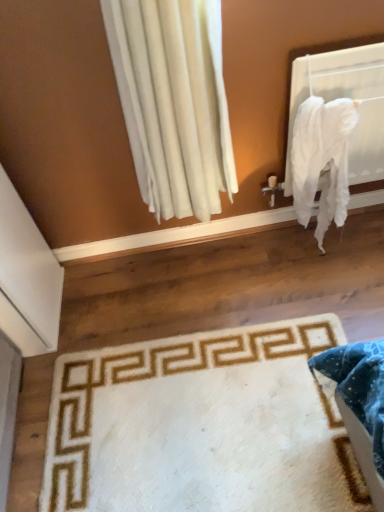
Question: Does white fabric at upper right lie behind white plush rug at lower center?

Choices:
 (A) yes
 (B) no

Answer: (A)

Question: Is white fabric at upper right positioned with its back to white plush rug at lower center?

Choices:
 (A) yes
 (B) no

Answer: (B)

Question: From the image's perspective, is white fabric at upper right located above white plush rug at lower center?

Choices:
 (A) yes
 (B) no

Answer: (A)

Question: Can you confirm if white fabric at upper right is taller than white plush rug at lower center?

Choices:
 (A) yes
 (B) no

Answer: (A)

Question: Is white plush rug at lower center surrounded by white fabric at upper right?

Choices:
 (A) yes
 (B) no

Answer: (B)

Question: Considering the positions of white plush rug at lower center and white cotton blanket at right in the image, is white plush rug at lower center bigger or smaller than white cotton blanket at right?

Choices:
 (A) small
 (B) big

Answer: (A)

Question: In terms of height, does white plush rug at lower center look taller or shorter compared to white cotton blanket at right?

Choices:
 (A) short
 (B) tall

Answer: (A)

Question: Considering the positions of white plush rug at lower center and white cotton blanket at right in the image, is white plush rug at lower center wider or thinner than white cotton blanket at right?

Choices:
 (A) wide
 (B) thin

Answer: (A)

Question: From a real-world perspective, relative to white cotton blanket at right, is white plush rug at lower center vertically above or below?

Choices:
 (A) below
 (B) above

Answer: (A)

Question: Is point (279, 477) closer or farther from the camera than point (292, 124)?

Choices:
 (A) farther
 (B) closer

Answer: (B)

Question: From the image's perspective, is white plush rug at lower center above or below white fabric at upper right?

Choices:
 (A) above
 (B) below

Answer: (B)

Question: Relative to white fabric at upper right, is white plush rug at lower center in front or behind?

Choices:
 (A) behind
 (B) front

Answer: (B)

Question: In terms of width, does white plush rug at lower center look wider or thinner when compared to white fabric at upper right?

Choices:
 (A) thin
 (B) wide

Answer: (B)

Question: Considering the positions of white fabric at upper right and white plush rug at lower center in the image, is white fabric at upper right wider or thinner than white plush rug at lower center?

Choices:
 (A) thin
 (B) wide

Answer: (A)

Question: Relative to white plush rug at lower center, is white fabric at upper right in front or behind?

Choices:
 (A) front
 (B) behind

Answer: (B)